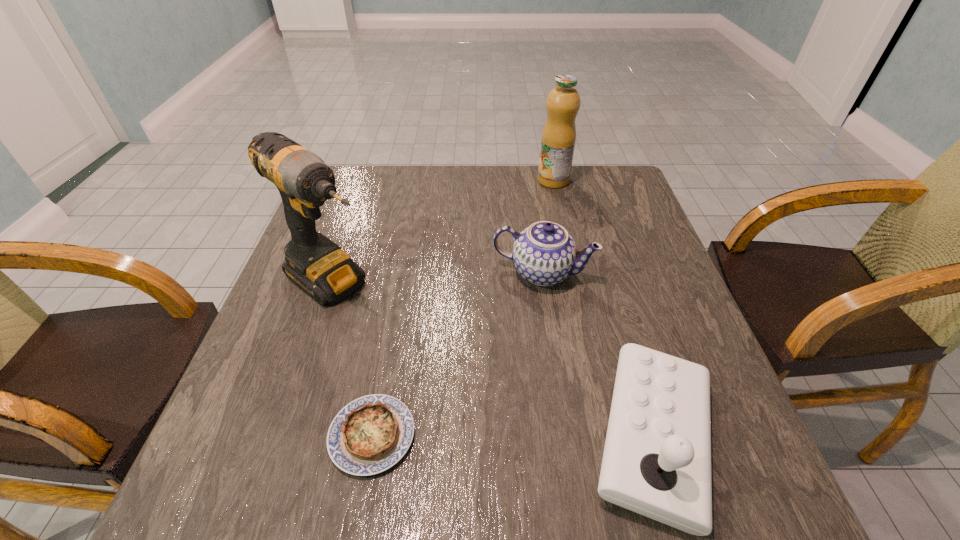
Where is `the shortest object`? the shortest object is located at coordinates coord(369,435).

Locate an element on the screen. chinaware is located at coordinates (544, 253).

Locate an element on the screen. drill is located at coordinates (317, 265).

You are a GUI agent. You are given a task and a screenshot of the screen. Output one action in this format:
    pyautogui.click(x=<x>, y=<y>)
    Task: Click on the fruit juice
    
    Given the screenshot: What is the action you would take?
    pyautogui.click(x=558, y=139)

Find the location of a particular element. vacant region located on the left of the quiche is located at coordinates (300, 435).

Locate an element on the screen. free space located at the spout of the chinaware is located at coordinates (489, 406).

Where is `free space located 0.310m at the spout of the chinaware`? The width and height of the screenshot is (960, 540). free space located 0.310m at the spout of the chinaware is located at coordinates (487, 410).

Where is `vacant space located 0.050m at the spout of the chinaware`? This screenshot has height=540, width=960. vacant space located 0.050m at the spout of the chinaware is located at coordinates (523, 309).

The width and height of the screenshot is (960, 540). What are the coordinates of `free spot located 0.350m with the drill bit of the drill facing forward` in the screenshot? It's located at (490, 390).

Find the location of a particular element. The image size is (960, 540). vacant space situated with the drill bit of the drill facing forward is located at coordinates (453, 364).